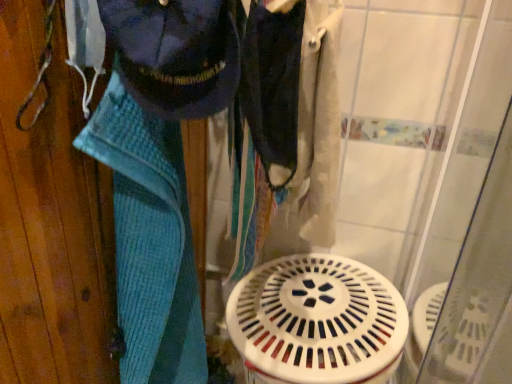
Question: Is dark blue fabric at center, which appears as the second clothing when viewed from the left, with navy blue fabric at upper left, acting as the second clothing starting from the right?

Choices:
 (A) yes
 (B) no

Answer: (A)

Question: Does dark blue fabric at center, which appears as the second clothing when viewed from the left, have a lesser width compared to navy blue fabric at upper left, marked as the 1th clothing in a left-to-right arrangement?

Choices:
 (A) no
 (B) yes

Answer: (B)

Question: Can you confirm if dark blue fabric at center, the 1th clothing positioned from the right, is positioned to the left of navy blue fabric at upper left, acting as the second clothing starting from the right?

Choices:
 (A) no
 (B) yes

Answer: (A)

Question: Does dark blue fabric at center, which appears as the second clothing when viewed from the left, have a smaller size compared to navy blue fabric at upper left, marked as the 1th clothing in a left-to-right arrangement?

Choices:
 (A) yes
 (B) no

Answer: (A)

Question: Is dark blue fabric at center, which appears as the second clothing when viewed from the left, outside navy blue fabric at upper left, acting as the second clothing starting from the right?

Choices:
 (A) yes
 (B) no

Answer: (A)

Question: In the image, is navy blue fabric at upper left, marked as the 1th clothing in a left-to-right arrangement, on the left side or the right side of blue knitted towel at left?

Choices:
 (A) left
 (B) right

Answer: (B)

Question: In terms of height, does navy blue fabric at upper left, acting as the second clothing starting from the right, look taller or shorter compared to blue knitted towel at left?

Choices:
 (A) short
 (B) tall

Answer: (A)

Question: Is navy blue fabric at upper left, acting as the second clothing starting from the right, bigger or smaller than blue knitted towel at left?

Choices:
 (A) big
 (B) small

Answer: (B)

Question: Is point (152, 87) closer or farther from the camera than point (34, 319)?

Choices:
 (A) farther
 (B) closer

Answer: (B)

Question: From the image's perspective, relative to navy blue fabric at upper left, marked as the 1th clothing in a left-to-right arrangement, is blue knitted towel at left above or below?

Choices:
 (A) below
 (B) above

Answer: (A)

Question: In terms of height, does blue knitted towel at left look taller or shorter compared to navy blue fabric at upper left, acting as the second clothing starting from the right?

Choices:
 (A) tall
 (B) short

Answer: (A)

Question: From a real-world perspective, is blue knitted towel at left physically located above or below navy blue fabric at upper left, acting as the second clothing starting from the right?

Choices:
 (A) below
 (B) above

Answer: (A)

Question: Relative to navy blue fabric at upper left, marked as the 1th clothing in a left-to-right arrangement, is blue knitted towel at left in front or behind?

Choices:
 (A) front
 (B) behind

Answer: (B)

Question: Looking at their shapes, would you say blue knitted towel at left is wider or thinner than white plastic water heater at center?

Choices:
 (A) wide
 (B) thin

Answer: (B)

Question: Is point [x=71, y=193] positioned closer to the camera than point [x=248, y=307]?

Choices:
 (A) farther
 (B) closer

Answer: (B)